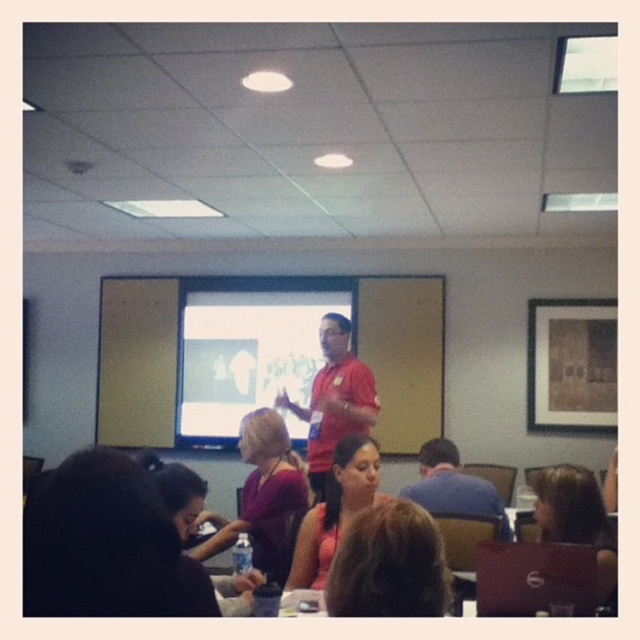
You are sitting at the back of the conference room and want to see both the white glossy projection screen at center and the matte pink shirt at center clearly. Which object is closer to you?

The white glossy projection screen at center is closer to you because it is further to the viewer than the matte pink shirt at center.

You are standing in the conference room and need to move from the point at coordinates point (557,540) to the point at coordinates point (481,490). Is the destination point closer to the wall or further away from it compared to your starting position?

The point (481,490) is further away from the wall than the starting point (557,540) because the starting point is in front of the destination point, indicating it is closer to the wall.